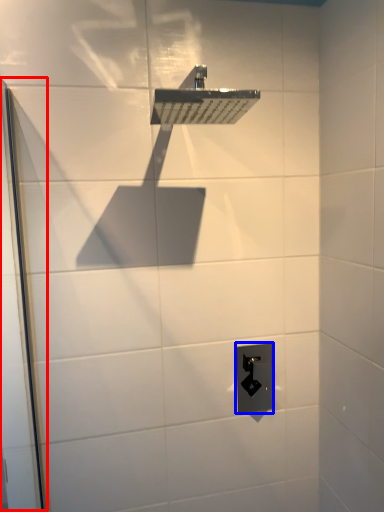
Question: Among these objects, which one is farthest to the camera, screen door (highlighted by a red box) or electric outlet (highlighted by a blue box)?

Choices:
 (A) screen door
 (B) electric outlet

Answer: (B)